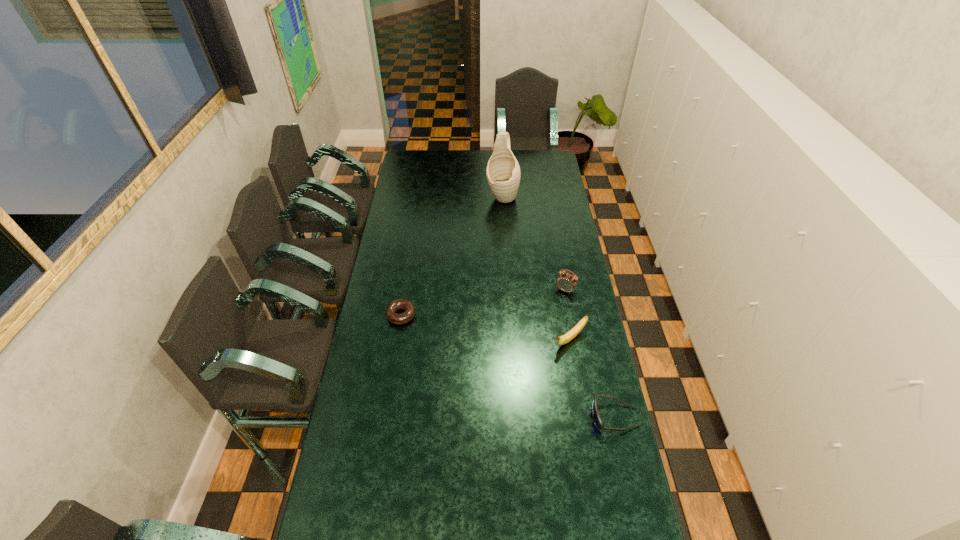
Identify the location of empty space that is in between the banana and the shortest object. (486, 327).

At what (x,y) coordinates should I click in order to perform the action: click on vacant area that lies between the fourth tallest object and the farthest object. Please return your answer as a coordinate pair (x, y). Looking at the image, I should click on (559, 307).

Locate an element on the screen. empty space between the pitcher and the alarm clock is located at coordinates (534, 244).

Identify the location of vacant point located between the nearest object and the fourth nearest object. The width and height of the screenshot is (960, 540). (590, 354).

Find the location of a particular element. The height and width of the screenshot is (540, 960). object that stands as the fourth closest to the fourth tallest object is located at coordinates (503, 172).

Locate which object is the closest to the sunglasses. Please provide its 2D coordinates. Your answer should be formatted as a tuple, i.e. [(x, y)], where the tuple contains the x and y coordinates of a point satisfying the conditions above.

[(564, 339)]

You are a GUI agent. You are given a task and a screenshot of the screen. Output one action in this format:
    pyautogui.click(x=<x>, y=<y>)
    Task: Click on the free space that satisfies the following two spatial constraints: 1. on the front side of the fourth shortest object; 2. on the right side of the tallest object
    This screenshot has width=960, height=540.
    Given the screenshot: What is the action you would take?
    pyautogui.click(x=508, y=290)

Image resolution: width=960 pixels, height=540 pixels. Find the location of `free location that satisfies the following two spatial constraints: 1. on the back side of the third nearest object; 2. on the left side of the tallest object`. free location that satisfies the following two spatial constraints: 1. on the back side of the third nearest object; 2. on the left side of the tallest object is located at coordinates (420, 197).

The width and height of the screenshot is (960, 540). In order to click on free space that satisfies the following two spatial constraints: 1. on the front side of the pitcher; 2. on the front-facing side of the fourth tallest object in this screenshot , I will do `click(516, 417)`.

The width and height of the screenshot is (960, 540). Identify the location of vacant position in the image that satisfies the following two spatial constraints: 1. on the front side of the second shortest object; 2. on the front-facing side of the third shortest object. (584, 417).